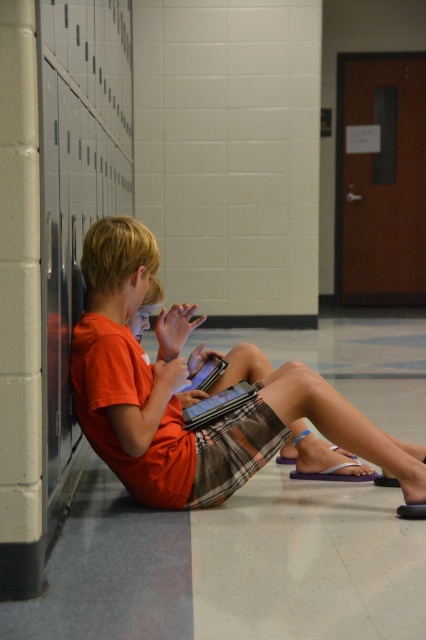
Question: Is orange cotton shirt at center bigger than shiny black laptop at center?

Choices:
 (A) yes
 (B) no

Answer: (A)

Question: Is shiny black laptop at center to the right of matte black laptop at center from the viewer's perspective?

Choices:
 (A) no
 (B) yes

Answer: (B)

Question: Which point appears closest to the camera in this image?

Choices:
 (A) (247, 400)
 (B) (149, 248)
 (C) (192, 388)

Answer: (B)

Question: Which object is the closest to the matte black laptop at center?

Choices:
 (A) orange cotton shirt at center
 (B) shiny black laptop at center

Answer: (B)

Question: Considering the real-world distances, which object is farthest from the shiny black laptop at center?

Choices:
 (A) matte black laptop at center
 (B) orange cotton shirt at center

Answer: (A)

Question: Is orange cotton shirt at center positioned before shiny black laptop at center?

Choices:
 (A) yes
 (B) no

Answer: (A)